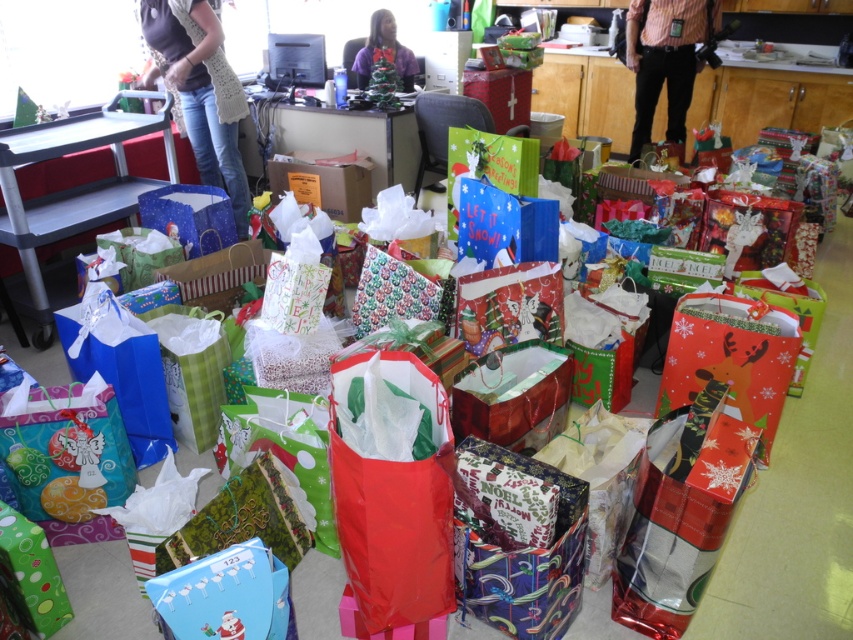
Is the position of striped shirt at upper right less distant than that of cardboard box at center?

No, striped shirt at upper right is further to the viewer.

The image size is (853, 640). Describe the element at coordinates (665, 60) in the screenshot. I see `striped shirt at upper right` at that location.

Image resolution: width=853 pixels, height=640 pixels. I want to click on striped shirt at upper right, so click(x=665, y=60).

Identify the location of striped shirt at upper right. This screenshot has width=853, height=640. (665, 60).

Locate an element on the screen. This screenshot has height=640, width=853. cardboard box at center is located at coordinates (323, 182).

Does point (300, 195) come closer to viewer compared to point (369, 36)?

Yes, it is in front of point (369, 36).

The height and width of the screenshot is (640, 853). Identify the location of cardboard box at center. (323, 182).

Is point (218, 160) less distant than point (651, 13)?

Yes, it is.

Locate an element on the screen. The image size is (853, 640). denim jeans at left is located at coordinates (200, 90).